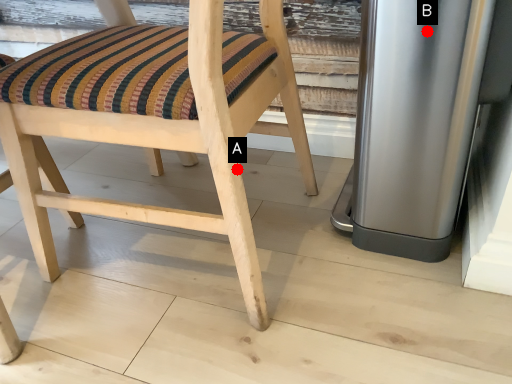
Question: Two points are circled on the image, labeled by A and B beside each circle. Which point appears farthest from the camera in this image?

Choices:
 (A) A is further
 (B) B is further

Answer: (A)